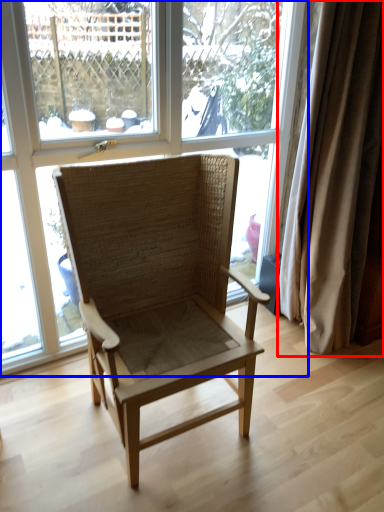
Question: Which object is closer to the camera taking this photo, curtain (highlighted by a red box) or window (highlighted by a blue box)?

Choices:
 (A) curtain
 (B) window

Answer: (B)